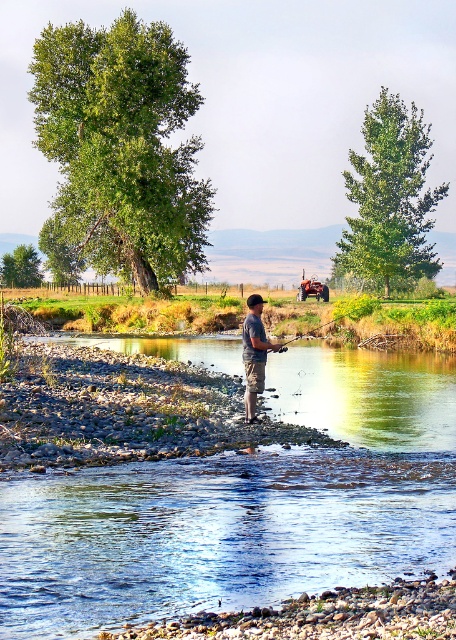
Question: Is light brown leather boots at center wider than wooden fishing pole at center?

Choices:
 (A) no
 (B) yes

Answer: (A)

Question: Is the position of light brown leather boots at center more distant than that of wooden fishing pole at center?

Choices:
 (A) no
 (B) yes

Answer: (A)

Question: Which point is closer to the camera taking this photo?

Choices:
 (A) (268, 349)
 (B) (248, 352)

Answer: (B)

Question: Does light brown leather boots at center have a smaller size compared to wooden fishing pole at center?

Choices:
 (A) no
 (B) yes

Answer: (B)

Question: Which of the following is the farthest from the observer?

Choices:
 (A) (253, 410)
 (B) (306, 333)

Answer: (B)